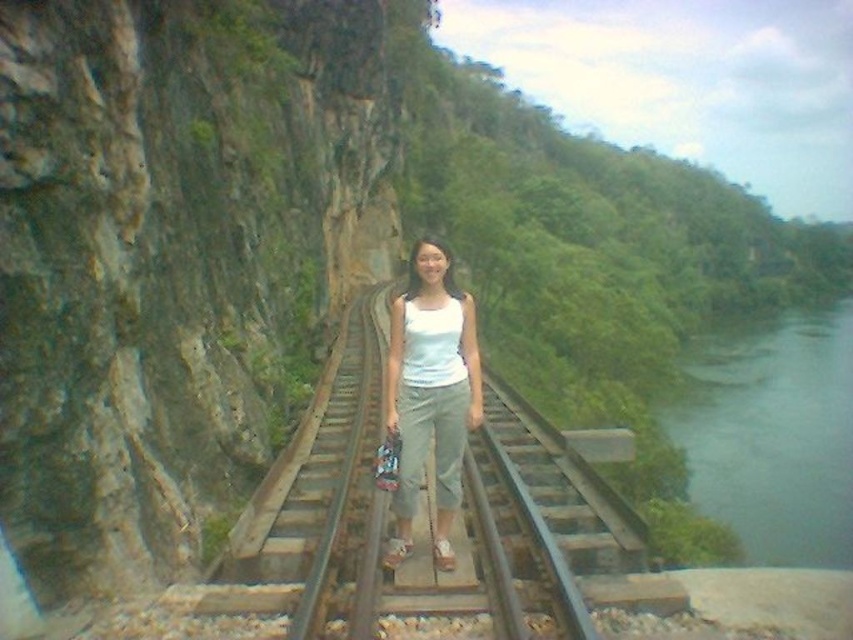
You are standing on the railway track and see the point marked at coordinates (770, 433). What is the color of the object located at that point?

The point at coordinates (770, 433) indicates green water at right.

You are a hiker who wants to cross the railway track to reach the green water at right. The white cotton tank top at center is blocking your path. Can you walk around it?

The white cotton tank top at center is blocking your path to the green water at right, so you need to walk around it. Since the green water at right might be wider than the white cotton tank top at center, you can go around either side of the white cotton tank top at center to reach the green water at right.

You are a hiker who wants to reach the green water at right from your current position near the white cotton tank top at center. Considering the distance between them, can you estimate how long it would take you to walk there at a normal pace?

The distance between the green water at right and the white cotton tank top at center is 325.14 feet. At a normal walking pace of about 3 feet per second, it would take approximately 108 seconds, which is roughly 1 minute and 48 seconds.